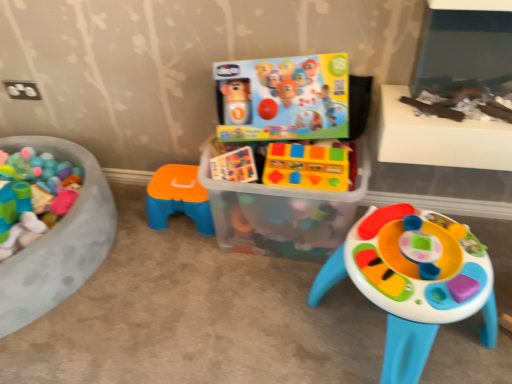
Question: Does yellow plastic toy blocks at center, arranged as the second toy when viewed from the right, have a larger size compared to orange plastic stool at center, which appears as the 1th toy when viewed from the left?

Choices:
 (A) yes
 (B) no

Answer: (B)

Question: Is orange plastic stool at center, the third toy when ordered from right to left, a part of yellow plastic toy blocks at center, arranged as the second toy when viewed from the right?

Choices:
 (A) yes
 (B) no

Answer: (B)

Question: Is the depth of yellow plastic toy blocks at center, which is counted as the 2th toy, starting from the left, less than that of orange plastic stool at center, which appears as the 1th toy when viewed from the left?

Choices:
 (A) yes
 (B) no

Answer: (A)

Question: Is yellow plastic toy blocks at center, arranged as the second toy when viewed from the right, directly adjacent to orange plastic stool at center, the third toy when ordered from right to left?

Choices:
 (A) yes
 (B) no

Answer: (B)

Question: Can you confirm if yellow plastic toy blocks at center, arranged as the second toy when viewed from the right, is positioned to the right of orange plastic stool at center, which appears as the 1th toy when viewed from the left?

Choices:
 (A) yes
 (B) no

Answer: (A)

Question: In terms of width, does orange plastic stool at center, which appears as the 1th toy when viewed from the left, look wider or thinner when compared to plastic colorful activity table at center, arranged as the first toy when viewed from the right?

Choices:
 (A) wide
 (B) thin

Answer: (B)

Question: In terms of size, does orange plastic stool at center, the third toy when ordered from right to left, appear bigger or smaller than plastic colorful activity table at center, the third toy in the left-to-right sequence?

Choices:
 (A) big
 (B) small

Answer: (B)

Question: From a real-world perspective, is orange plastic stool at center, which appears as the 1th toy when viewed from the left, above or below plastic colorful activity table at center, the third toy in the left-to-right sequence?

Choices:
 (A) above
 (B) below

Answer: (B)

Question: Is orange plastic stool at center, the third toy when ordered from right to left, in front of or behind plastic colorful activity table at center, the third toy in the left-to-right sequence, in the image?

Choices:
 (A) front
 (B) behind

Answer: (B)

Question: Is point (247, 170) closer or farther from the camera than point (392, 97)?

Choices:
 (A) closer
 (B) farther

Answer: (B)

Question: Considering the positions of yellow plastic toy blocks at center, which is counted as the 2th toy, starting from the left, and white plastic table at upper right in the image, is yellow plastic toy blocks at center, which is counted as the 2th toy, starting from the left, bigger or smaller than white plastic table at upper right?

Choices:
 (A) small
 (B) big

Answer: (A)

Question: From the image's perspective, relative to white plastic table at upper right, is yellow plastic toy blocks at center, which is counted as the 2th toy, starting from the left, above or below?

Choices:
 (A) above
 (B) below

Answer: (B)

Question: From a real-world perspective, is yellow plastic toy blocks at center, arranged as the second toy when viewed from the right, positioned above or below white plastic table at upper right?

Choices:
 (A) below
 (B) above

Answer: (A)

Question: Considering their positions, is translucent plastic container at center located in front of or behind white plastic table at upper right?

Choices:
 (A) front
 (B) behind

Answer: (B)

Question: Looking at their shapes, would you say translucent plastic container at center is wider or thinner than white plastic table at upper right?

Choices:
 (A) wide
 (B) thin

Answer: (A)